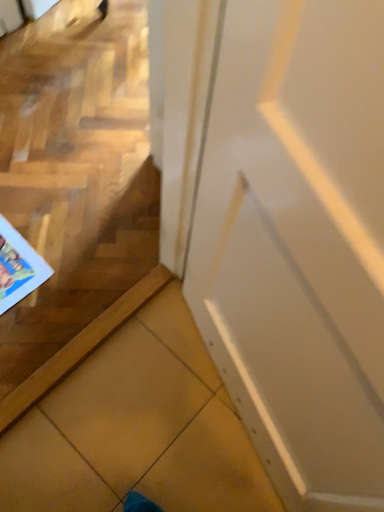
What do you see at coordinates (298, 243) in the screenshot? The height and width of the screenshot is (512, 384). I see `white glossy door at center` at bounding box center [298, 243].

This screenshot has width=384, height=512. What are the coordinates of `white glossy door at center` in the screenshot? It's located at (298, 243).

This screenshot has height=512, width=384. In order to click on matte paper comic book at lower left in this screenshot , I will do click(18, 267).

What do you see at coordinates (18, 267) in the screenshot? This screenshot has width=384, height=512. I see `matte paper comic book at lower left` at bounding box center [18, 267].

Where is `white glossy door at center`? This screenshot has width=384, height=512. white glossy door at center is located at coordinates (298, 243).

Based on their positions, is white glossy door at center located to the left or right of matte paper comic book at lower left?

white glossy door at center is positioned on matte paper comic book at lower left's right side.

Which object is closer to the camera, white glossy door at center or matte paper comic book at lower left?

white glossy door at center.

Which point is more forward, (377, 285) or (21, 270)?

→ The point (377, 285) is closer.

Looking at this image, from the image's perspective, is white glossy door at center below matte paper comic book at lower left?

Yes, from the image's perspective, white glossy door at center is below matte paper comic book at lower left.

From a real-world perspective, is white glossy door at center physically located above or below matte paper comic book at lower left?

white glossy door at center is above matte paper comic book at lower left.

Considering the sizes of objects white glossy door at center and matte paper comic book at lower left in the image provided, who is thinner, white glossy door at center or matte paper comic book at lower left?

white glossy door at center is thinner.

Considering the sizes of white glossy door at center and matte paper comic book at lower left in the image, is white glossy door at center taller or shorter than matte paper comic book at lower left?

Considering their sizes, white glossy door at center has more height than matte paper comic book at lower left.

Is white glossy door at center bigger than matte paper comic book at lower left?

Correct, white glossy door at center is larger in size than matte paper comic book at lower left.

Is white glossy door at center located outside matte paper comic book at lower left?

white glossy door at center lies outside matte paper comic book at lower left's area.

Would you consider white glossy door at center to be distant from matte paper comic book at lower left?

No, white glossy door at center is in close proximity to matte paper comic book at lower left.

Is white glossy door at center facing away from matte paper comic book at lower left?

white glossy door at center does not have its back to matte paper comic book at lower left.

Identify the location of comic book located underneath the white glossy door at center (from a real-world perspective). (18, 267).

Does matte paper comic book at lower left appear on the right side of white glossy door at center?

In fact, matte paper comic book at lower left is to the left of white glossy door at center.

Is matte paper comic book at lower left closer to the viewer compared to white glossy door at center?

No, matte paper comic book at lower left is behind white glossy door at center.

Which is closer to the camera, (10,301) or (227,174)?

Point (10,301).

From the image's perspective, relative to white glossy door at center, is matte paper comic book at lower left above or below?

From the image's perspective, matte paper comic book at lower left appears above white glossy door at center.

From a real-world perspective, between matte paper comic book at lower left and white glossy door at center, who is vertically higher?

In real-world perspective, white glossy door at center is above.

Considering the relative sizes of matte paper comic book at lower left and white glossy door at center in the image provided, is matte paper comic book at lower left wider than white glossy door at center?

Yes.

Considering the sizes of objects matte paper comic book at lower left and white glossy door at center in the image provided, who is taller, matte paper comic book at lower left or white glossy door at center?

Standing taller between the two is white glossy door at center.

Between matte paper comic book at lower left and white glossy door at center, which one has larger size?

Bigger between the two is white glossy door at center.

Is matte paper comic book at lower left spatially inside white glossy door at center, or outside of it?

matte paper comic book at lower left is spatially situated outside white glossy door at center.

Is there a large distance between matte paper comic book at lower left and white glossy door at center?

They are positioned close to each other.

Looking at this image, is matte paper comic book at lower left positioned with its back to white glossy door at center?

No, matte paper comic book at lower left's orientation is not away from white glossy door at center.

Measure the distance from matte paper comic book at lower left to white glossy door at center.

A: matte paper comic book at lower left and white glossy door at center are 30.84 inches apart from each other.

Locate an element on the screen. door lying on the right of matte paper comic book at lower left is located at coordinates (298, 243).

Locate an element on the screen. This screenshot has height=512, width=384. comic book behind the white glossy door at center is located at coordinates (18, 267).

The width and height of the screenshot is (384, 512). Identify the location of door lying below the matte paper comic book at lower left (from the image's perspective). (x=298, y=243).